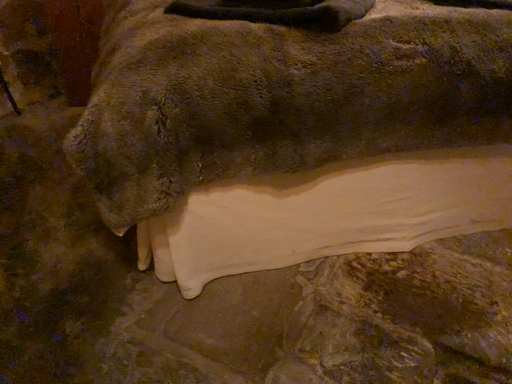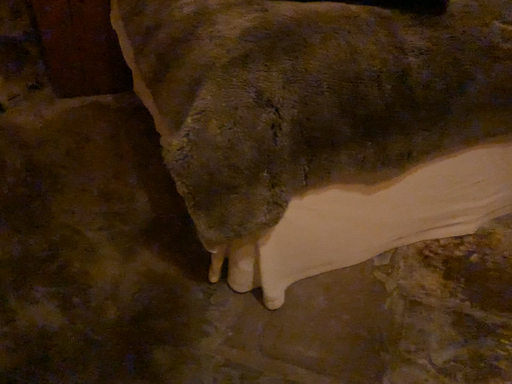
Question: Which way did the camera rotate in the video?

Choices:
 (A) rotated left
 (B) rotated right

Answer: (B)